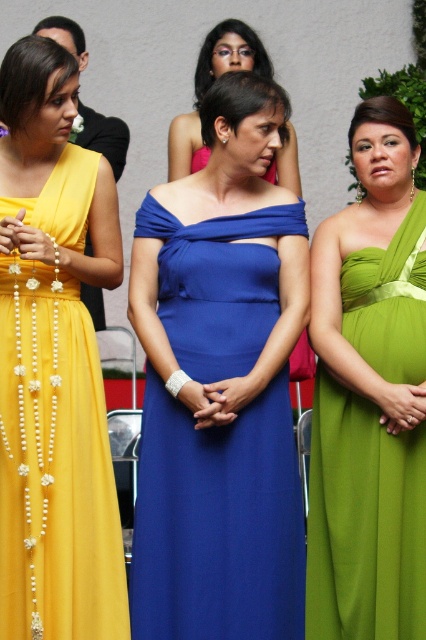
Is yellow satin dress at left smaller than blue satin dress at center?

Yes, yellow satin dress at left is smaller than blue satin dress at center.

Measure the distance between point [29,628] and camera.

Point [29,628] is 3.56 meters away from camera.

Locate an element on the screen. yellow satin dress at left is located at coordinates (55, 465).

Between yellow satin dress at left and green satin dress at right, which one has less height?

Standing shorter between the two is green satin dress at right.

Is point (54, 380) positioned behind point (322, 596)?

No, it is not.

In order to click on yellow satin dress at left in this screenshot , I will do `click(55, 465)`.

Who is positioned more to the right, green satin dress at right or blue satin dress at center?

Positioned to the right is green satin dress at right.

Does point (374, 317) come closer to viewer compared to point (236, 65)?

Yes, it is.

Find the location of a particular element. This screenshot has width=426, height=640. green satin dress at right is located at coordinates (363, 520).